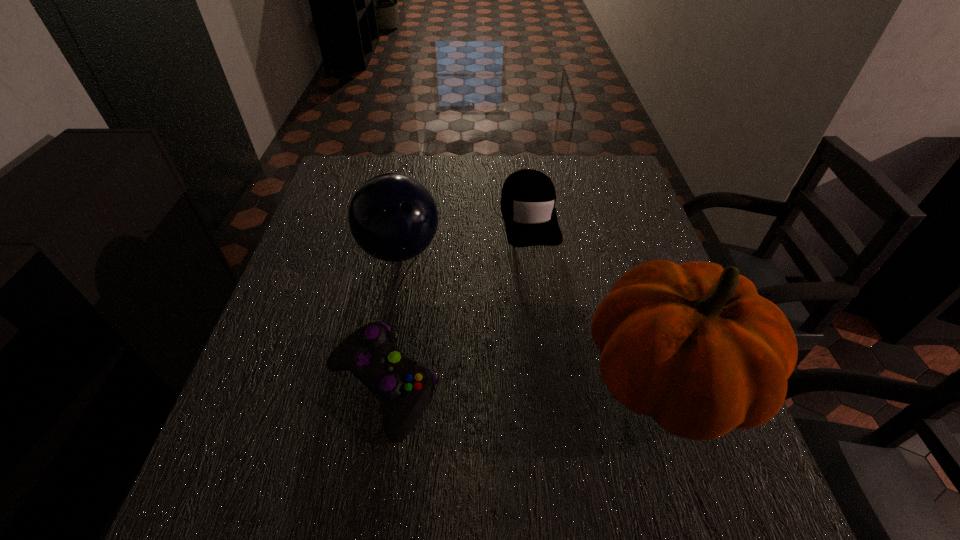
Where is `vacant space located 0.180m on the front-facing side of the cap`? Image resolution: width=960 pixels, height=540 pixels. vacant space located 0.180m on the front-facing side of the cap is located at coordinates (548, 302).

This screenshot has width=960, height=540. In order to click on vacant area situated on the front-facing side of the cap in this screenshot , I will do `click(566, 380)`.

The width and height of the screenshot is (960, 540). Find the location of `object that is at the far edge`. object that is at the far edge is located at coordinates (528, 198).

In order to click on control that is at the near edge in this screenshot , I will do `click(404, 387)`.

At what (x,y) coordinates should I click in order to perform the action: click on pumpkin at the near edge. Please return your answer as a coordinate pair (x, y). The height and width of the screenshot is (540, 960). Looking at the image, I should click on (694, 346).

This screenshot has height=540, width=960. I want to click on control that is at the left edge, so click(404, 387).

The width and height of the screenshot is (960, 540). Identify the location of bowling ball present at the left edge. (393, 217).

What are the coordinates of `object that is at the right edge` in the screenshot? It's located at (694, 346).

The image size is (960, 540). Identify the location of object at the near left corner. (404, 387).

Where is `object located at the near right corner`? The height and width of the screenshot is (540, 960). object located at the near right corner is located at coordinates (694, 346).